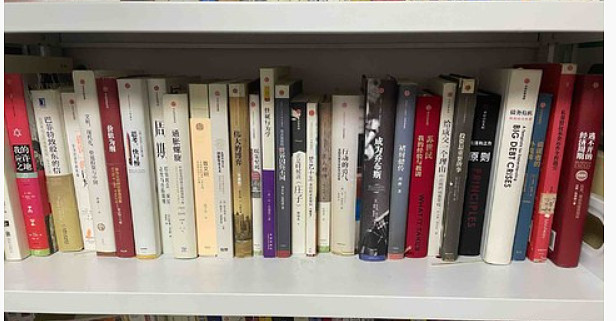
Where is `red books`? Image resolution: width=616 pixels, height=321 pixels. red books is located at coordinates (31, 200), (115, 189), (418, 169), (549, 173), (578, 183).